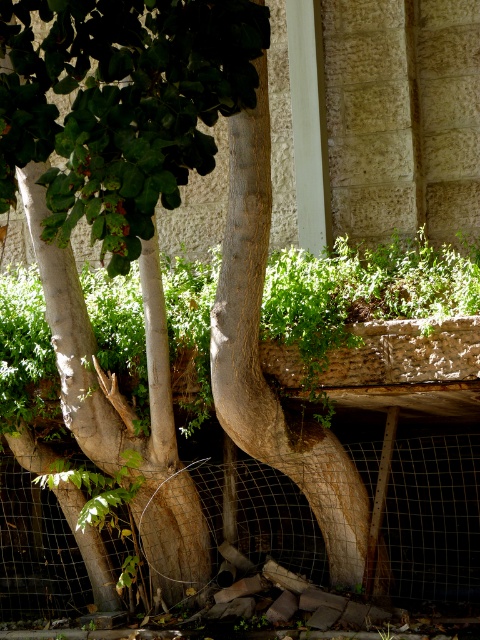
Find the location of a particular element. This screenshot has height=640, width=480. wire mesh fence at lower center is located at coordinates (433, 518).

Looking at this image, is wire mesh fence at lower center closer to the viewer compared to brown rough bark at center?

No, it is not.

At what (x,y) coordinates should I click in order to perform the action: click on wire mesh fence at lower center. Please return your answer as a coordinate pair (x, y). This screenshot has width=480, height=640. Looking at the image, I should click on (433, 518).

Is point (184, 268) less distant than point (302, 568)?

No.

Does green leafy plant at center appear under wire mesh fence at lower center?

No, green leafy plant at center is not below wire mesh fence at lower center.

What do you see at coordinates (360, 296) in the screenshot? I see `green leafy plant at center` at bounding box center [360, 296].

I want to click on green leafy plant at center, so click(360, 296).

How much distance is there between green leafy plant at center and brown rough bark at center?

The distance of green leafy plant at center from brown rough bark at center is 36.19 inches.

Is green leafy plant at center further to the viewer compared to brown rough bark at center?

Yes, green leafy plant at center is further from the viewer.

Where is `green leafy plant at center`? This screenshot has width=480, height=640. green leafy plant at center is located at coordinates (360, 296).